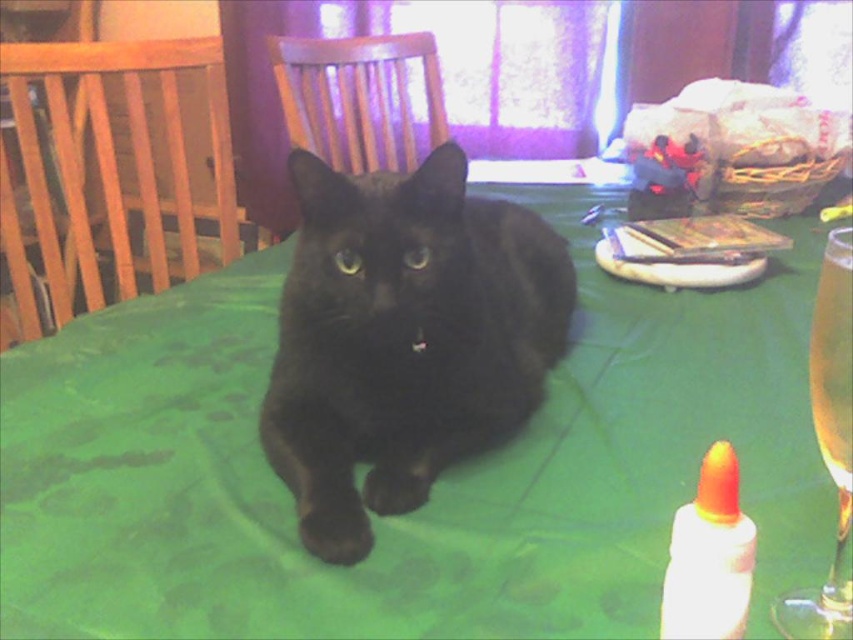
Question: Can you confirm if green fabric table at center is wider than translucent glass at upper right?

Choices:
 (A) no
 (B) yes

Answer: (B)

Question: Does black glossy cat at center have a lesser width compared to white glossy glue bottle at lower right?

Choices:
 (A) no
 (B) yes

Answer: (A)

Question: Which of the following is the closest to the observer?

Choices:
 (A) (838, 230)
 (B) (541, 392)

Answer: (B)

Question: Which object appears farthest from the camera in this image?

Choices:
 (A) green fabric table at center
 (B) translucent glass at upper right

Answer: (A)

Question: From the image, what is the correct spatial relationship of black glossy cat at center in relation to translucent glass wine at right?

Choices:
 (A) below
 (B) above

Answer: (B)

Question: Which is farther from the translucent glass wine at right?

Choices:
 (A) green fabric table at center
 (B) white glossy glue bottle at lower right

Answer: (A)